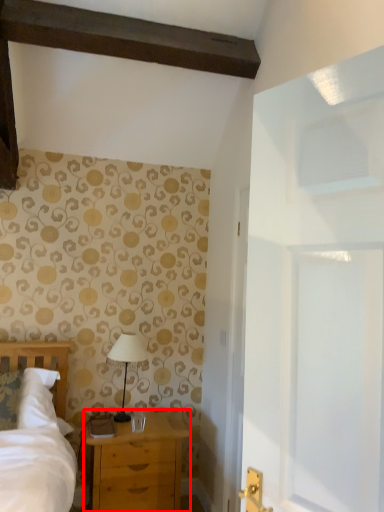
Question: From the image, what is the correct spatial relationship of chest of drawers (annotated by the red box) in relation to table lamp?

Choices:
 (A) left
 (B) right

Answer: (B)